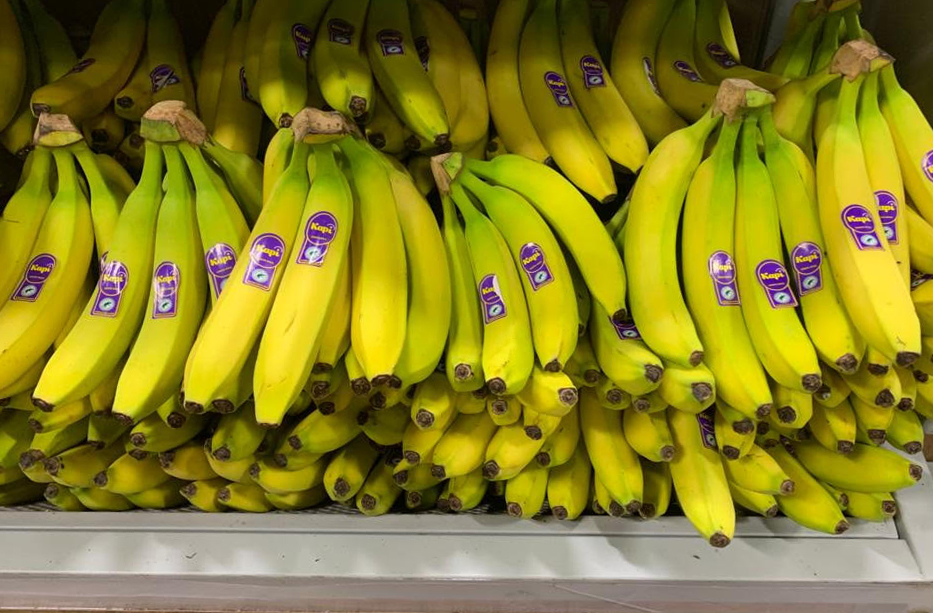
I want to click on white sections of shelf, so click(x=922, y=531), click(x=857, y=517), click(x=795, y=574), click(x=752, y=601).